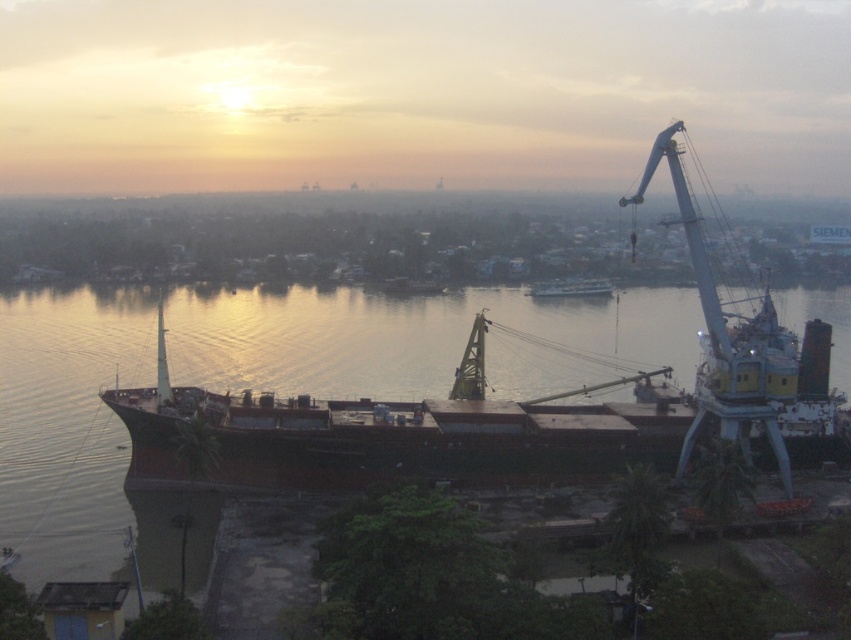
Question: Which point is closer to the camera taking this photo?

Choices:
 (A) (603, 289)
 (B) (113, 540)

Answer: (B)

Question: Does brown matte water at center have a lesser width compared to metallic gray boat at center?

Choices:
 (A) yes
 (B) no

Answer: (B)

Question: Does brown matte water at center appear over metallic gray boat at center?

Choices:
 (A) no
 (B) yes

Answer: (A)

Question: Is brown matte water at center above metallic gray boat at center?

Choices:
 (A) no
 (B) yes

Answer: (A)